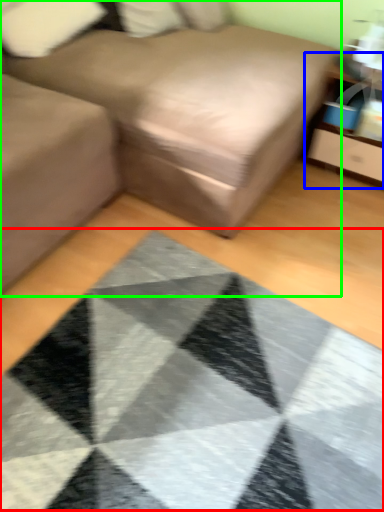
Question: Which object is the closest to the mat (highlighted by a red box)? Choose among these: dresser (highlighted by a blue box) or studio couch (highlighted by a green box).

Choices:
 (A) dresser
 (B) studio couch

Answer: (B)